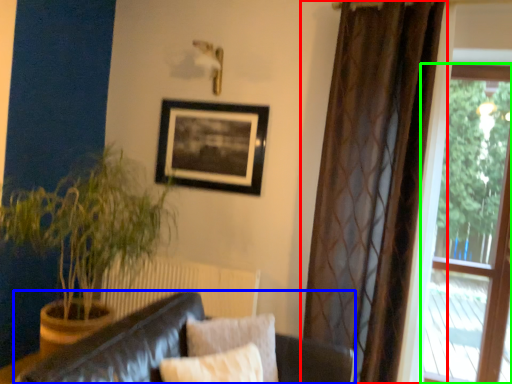
Question: Which object is the closest to the curtain (highlighted by a red box)? Choose among these: studio couch (highlighted by a blue box) or window (highlighted by a green box).

Choices:
 (A) studio couch
 (B) window

Answer: (A)